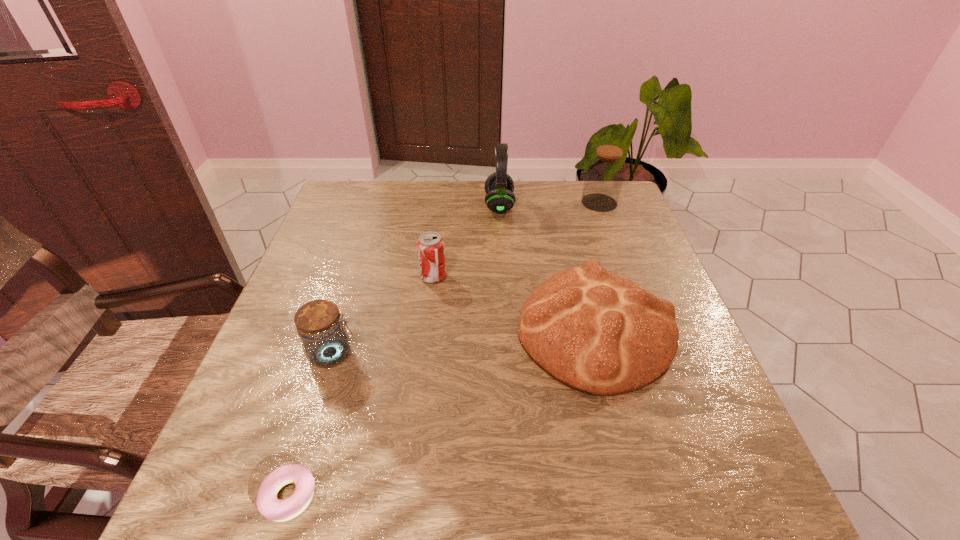
Find the location of a particular element. vacant space located on the ear cups of the headset is located at coordinates (448, 205).

Identify the location of free space located on the ear cups of the headset. (445, 205).

At what (x,y) coordinates should I click in order to perform the action: click on free space located 0.050m on the front of the taller jar. Please return your answer as a coordinate pair (x, y). The height and width of the screenshot is (540, 960). Looking at the image, I should click on (607, 222).

Locate an element on the screen. This screenshot has height=540, width=960. blank space located on the front of the fourth object from right to left is located at coordinates coord(422,373).

The width and height of the screenshot is (960, 540). I want to click on vacant area situated 0.240m on the left of the bread, so click(408, 330).

This screenshot has width=960, height=540. What are the coordinates of `vacant position located on the lid of the nearer jar` in the screenshot? It's located at (481, 354).

The height and width of the screenshot is (540, 960). What are the coordinates of `vacant region located on the right of the nearest object` in the screenshot? It's located at (360, 497).

Where is `headset that is positioned at the far edge`? The image size is (960, 540). headset that is positioned at the far edge is located at coordinates (499, 186).

Where is `jar located in the far edge section of the desktop`? jar located in the far edge section of the desktop is located at coordinates (605, 172).

At what (x,y) coordinates should I click in order to perform the action: click on object situated at the near edge. Please return your answer as a coordinate pair (x, y). This screenshot has height=540, width=960. Looking at the image, I should click on (269, 506).